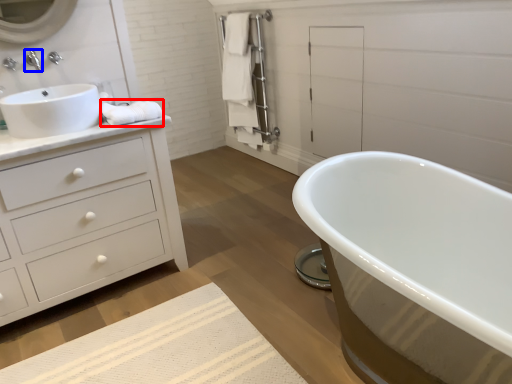
Question: Among these objects, which one is farthest to the camera, material (highlighted by a red box) or tap (highlighted by a blue box)?

Choices:
 (A) material
 (B) tap

Answer: (B)